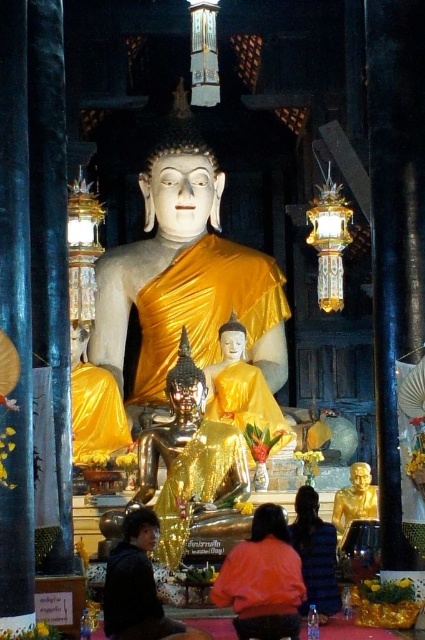
Consider the image. You are a temple visitor and want to take a photo of both the shiny gold statue at center and the gold metallic statue at lower center. Which statue should you move closer to in order to capture both in a single frame without zooming in?

You should move closer to the shiny gold statue at center because it is larger than the gold metallic statue at lower center, allowing both to fit in the frame without zooming.